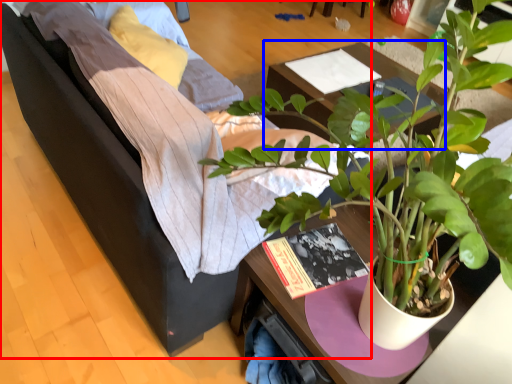
Question: Among these objects, which one is nearest to the camera, studio couch (highlighted by a red box) or table (highlighted by a blue box)?

Choices:
 (A) studio couch
 (B) table

Answer: (A)